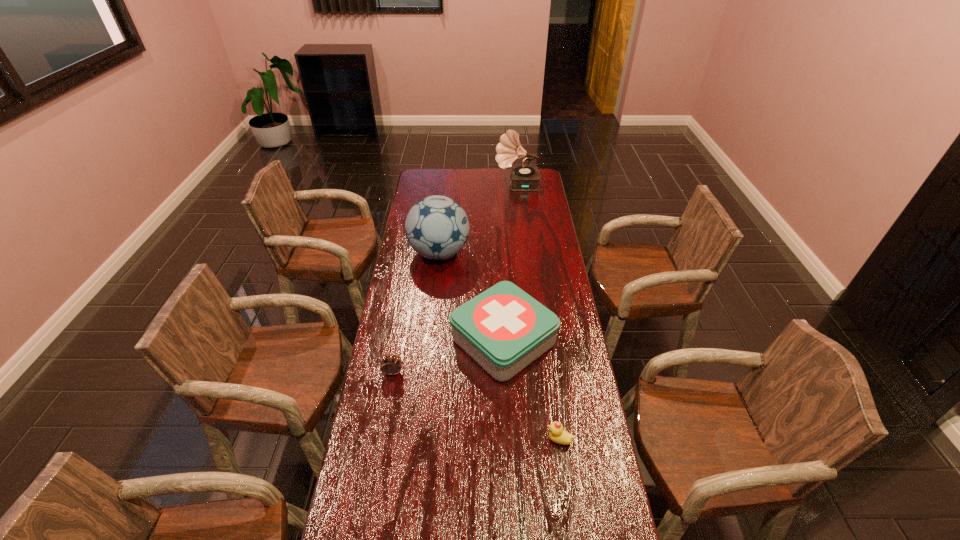
At what (x,y) coordinates should I click in order to perform the action: click on free space located 0.360m on the side with brand of the fourth nearest object. Please return your answer as a coordinate pair (x, y). This screenshot has height=540, width=960. Looking at the image, I should click on (548, 253).

You are a GUI agent. You are given a task and a screenshot of the screen. Output one action in this format:
    pyautogui.click(x=<x>, y=<y>)
    Task: Click on the free spot located 0.150m on the back of the third tallest object
    This screenshot has height=540, width=960.
    Given the screenshot: What is the action you would take?
    pyautogui.click(x=500, y=279)

Find the location of `vacant space located 0.100m on the face of the fourth tallest object`. vacant space located 0.100m on the face of the fourth tallest object is located at coordinates pyautogui.click(x=388, y=402).

Where is `vacant space located 0.390m on the front-facing side of the nearest object`? vacant space located 0.390m on the front-facing side of the nearest object is located at coordinates (420, 440).

The height and width of the screenshot is (540, 960). Find the location of `blank space located 0.200m on the front-facing side of the nearest object`. blank space located 0.200m on the front-facing side of the nearest object is located at coordinates (481, 440).

Locate an element on the screen. vacant space situated on the front-facing side of the nearest object is located at coordinates (491, 440).

This screenshot has height=540, width=960. Find the location of `object that is at the far edge`. object that is at the far edge is located at coordinates (523, 177).

Identify the location of soccer ball that is positioned at the left edge. (437, 227).

At what (x,y) coordinates should I click in order to perform the action: click on alarm clock that is positioned at the left edge. Please return your answer as a coordinate pair (x, y). Image resolution: width=960 pixels, height=540 pixels. Looking at the image, I should click on (391, 365).

I want to click on record player that is at the right edge, so click(523, 177).